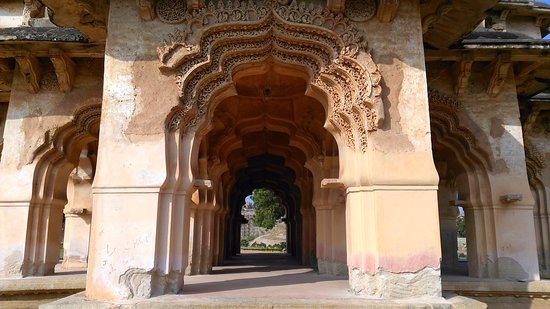
I want to click on wooden boards, so click(x=43, y=49), click(x=481, y=57).